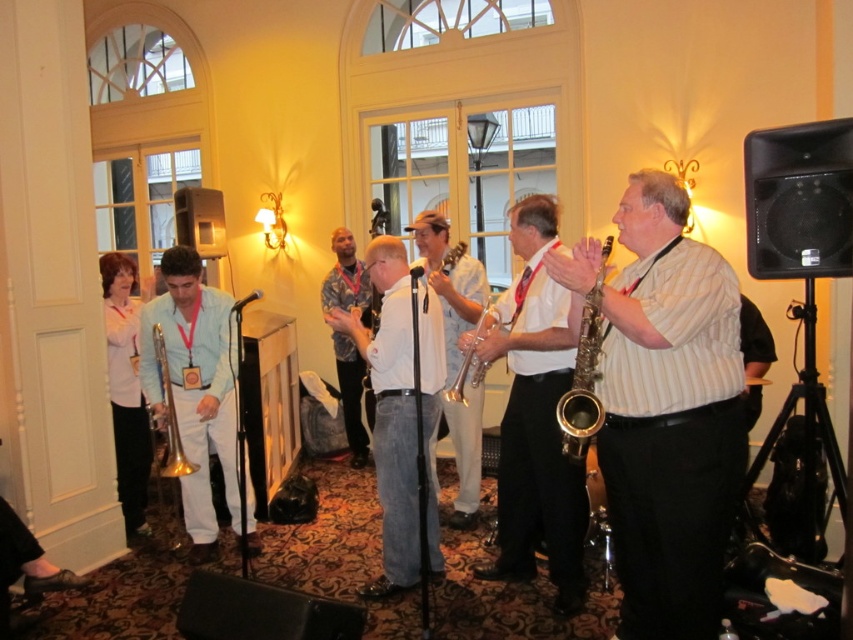
Question: Considering the real-world distances, which object is closest to the gold brass trumpet at center?

Choices:
 (A) gold brass trumpet at left
 (B) matte gold trumpet at left
 (C) matte gold saxophone at center

Answer: (C)

Question: Is white matte shirt at left further to camera compared to white striped shirt at center?

Choices:
 (A) no
 (B) yes

Answer: (A)

Question: Which of the following is the farthest from the observer?

Choices:
 (A) shiny brass trumpet at center
 (B) white matte shirt at left

Answer: (B)

Question: Considering the relative positions of white shirt at center and white matte shirt at left in the image provided, where is white shirt at center located with respect to white matte shirt at left?

Choices:
 (A) above
 (B) below

Answer: (A)

Question: Does white cotton shirt at center have a greater width compared to matte gold trumpet at left?

Choices:
 (A) no
 (B) yes

Answer: (A)

Question: Which object is positioned closest to the matte gold trumpet at left?

Choices:
 (A) white striped shirt at center
 (B) white glossy saxophone at center
 (C) white cotton shirt at center
 (D) matte gold saxophone at center

Answer: (C)